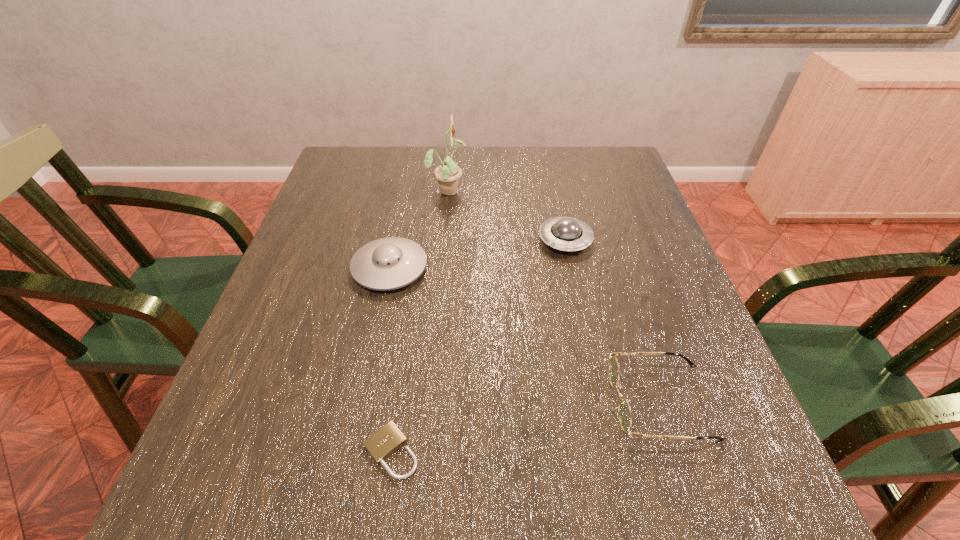
Identify the location of free space at the right edge. (660, 392).

The height and width of the screenshot is (540, 960). In order to click on vacant area at the far left corner in this screenshot , I will do `click(350, 190)`.

This screenshot has width=960, height=540. Identify the location of vacant space at the far right corner of the desktop. (612, 184).

The width and height of the screenshot is (960, 540). What are the coordinates of `free spot between the shortest object and the left saucer` in the screenshot? It's located at (391, 360).

This screenshot has width=960, height=540. Identify the location of empty space between the tallest object and the left saucer. (419, 229).

Locate an element on the screen. vacant point located between the left saucer and the sunflower is located at coordinates (419, 229).

At what (x,y) coordinates should I click in order to perform the action: click on vacant space in between the spectacles and the left saucer. Please return your answer as a coordinate pair (x, y). The height and width of the screenshot is (540, 960). Looking at the image, I should click on (525, 335).

The width and height of the screenshot is (960, 540). What are the coordinates of `free space between the spectacles and the left saucer` in the screenshot? It's located at (525, 335).

Identify the location of vacant area that lies between the shortest object and the spectacles. (526, 426).

Find the location of a particular element. This screenshot has width=960, height=540. free space between the shortest object and the right saucer is located at coordinates (478, 346).